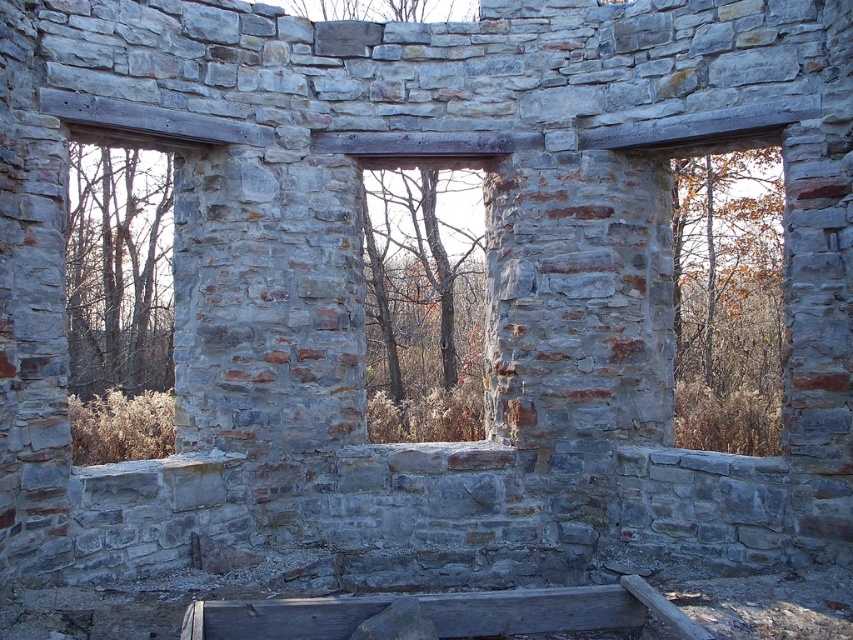
Question: Which object is positioned farthest from the stone window frame at center?

Choices:
 (A) gray stone window frame at left
 (B) smooth gray wood at lower center

Answer: (A)

Question: Which point is farther to the camera?

Choices:
 (A) (440, 332)
 (B) (216, 625)
 (C) (135, 301)

Answer: (C)

Question: Based on their relative distances, which object is farther from the smooth gray wood at lower center?

Choices:
 (A) gray stone window frame at left
 (B) stone window frame at center

Answer: (A)

Question: Can you confirm if gray stone window frame at left is smaller than stone window frame at center?

Choices:
 (A) no
 (B) yes

Answer: (A)

Question: Does gray stone window frame at left appear over stone window frame at center?

Choices:
 (A) yes
 (B) no

Answer: (A)

Question: Can you confirm if gray stone window frame at left is bigger than stone window frame at center?

Choices:
 (A) no
 (B) yes

Answer: (B)